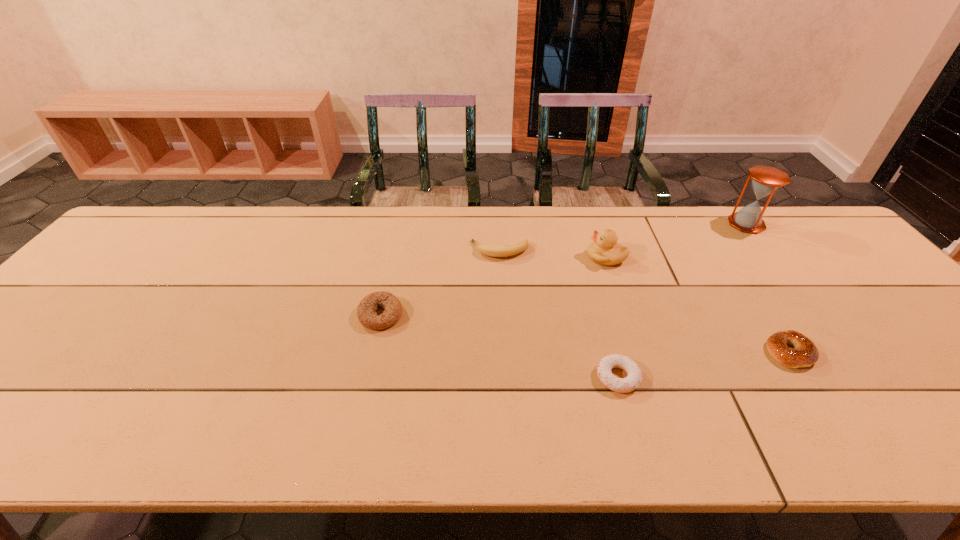
In order to click on free space between the farthest object and the doughnut in this screenshot , I will do `click(682, 301)`.

What are the coordinates of `unoccupied area between the right bagel and the doughnut` in the screenshot? It's located at (704, 364).

Where is `vacant area that lies between the doughnut and the second tallest object`? Image resolution: width=960 pixels, height=540 pixels. vacant area that lies between the doughnut and the second tallest object is located at coordinates (612, 317).

At what (x,y) coordinates should I click in order to perform the action: click on blank region between the second tallest object and the hourglass. Please return your answer as a coordinate pair (x, y). The height and width of the screenshot is (540, 960). Looking at the image, I should click on (676, 240).

Locate an element on the screen. empty location between the tallest object and the third nearest object is located at coordinates (564, 269).

Find the location of `free space between the left bagel and the duckling`. free space between the left bagel and the duckling is located at coordinates (493, 286).

This screenshot has width=960, height=540. I want to click on the second closest object relative to the duckling, so (x=622, y=385).

Where is `object that is the fourth nearest to the doughnut`? This screenshot has width=960, height=540. object that is the fourth nearest to the doughnut is located at coordinates (366, 309).

At what (x,y) coordinates should I click in order to perform the action: click on vacant area in the image that satisfies the following two spatial constraints: 1. on the back side of the doughnut; 2. on the left side of the farthest object. Please return your answer as a coordinate pair (x, y). The image size is (960, 540). Looking at the image, I should click on (575, 224).

At what (x,y) coordinates should I click in order to perform the action: click on vacant space that satisfies the following two spatial constraints: 1. at the stem of the right bagel; 2. on the left side of the banana. Please return your answer as a coordinate pair (x, y). Image resolution: width=960 pixels, height=540 pixels. Looking at the image, I should click on (505, 352).